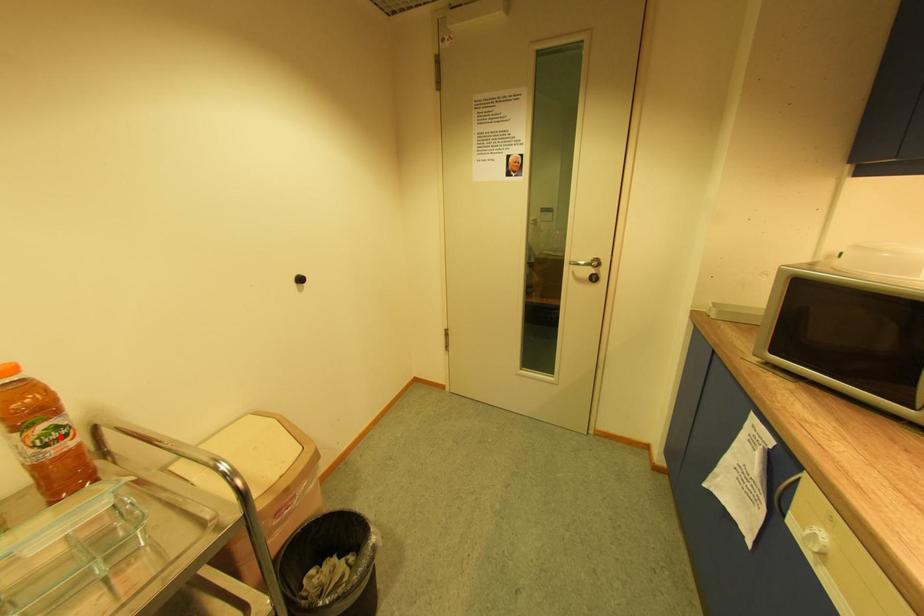
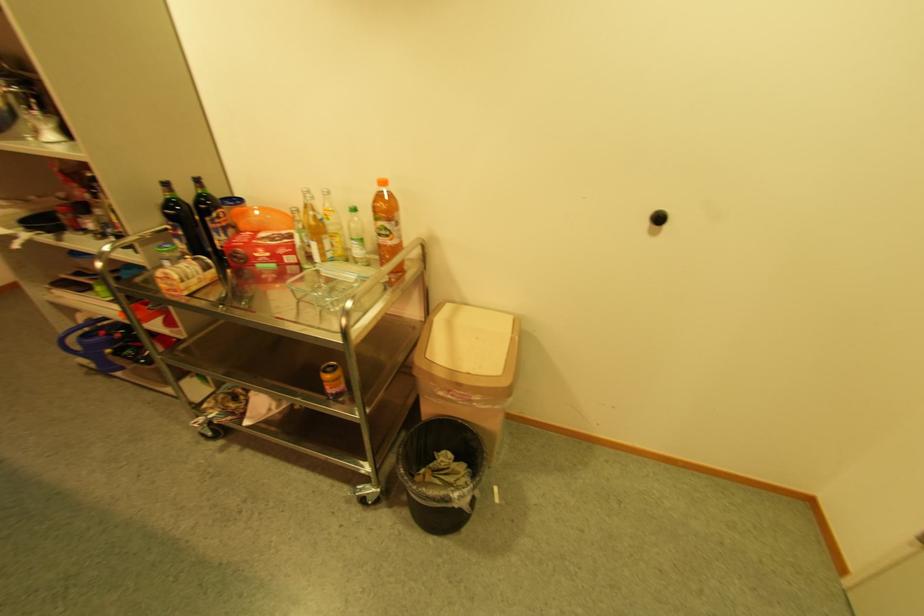
The point at the highlighted location is marked in the first image. Where is the corresponding point in the second image?

(391, 233)